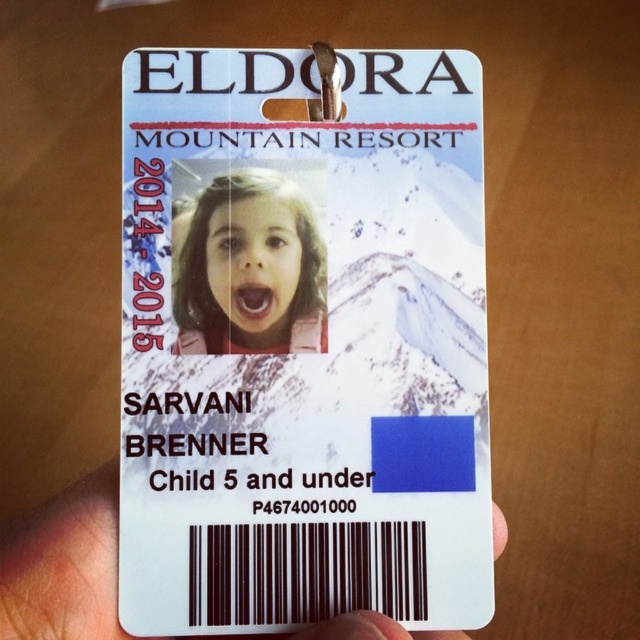
Question: Does white plastic card at center have a lesser width compared to white plastic hand at lower center?

Choices:
 (A) yes
 (B) no

Answer: (A)

Question: Which object appears farthest from the camera in this image?

Choices:
 (A) matte plastic photo at center
 (B) white plastic hand at lower center
 (C) white plastic card at center

Answer: (A)

Question: Which point appears closest to the camera in this image?

Choices:
 (A) (161, 560)
 (B) (61, 492)

Answer: (A)

Question: Estimate the real-world distances between objects in this image. Which object is closer to the matte plastic photo at center?

Choices:
 (A) white plastic card at center
 (B) white plastic hand at lower center

Answer: (A)

Question: Considering the relative positions of white plastic card at center and matte plastic photo at center in the image provided, where is white plastic card at center located with respect to matte plastic photo at center?

Choices:
 (A) left
 (B) right

Answer: (B)

Question: Does white plastic card at center appear on the left side of white plastic hand at lower center?

Choices:
 (A) no
 (B) yes

Answer: (A)